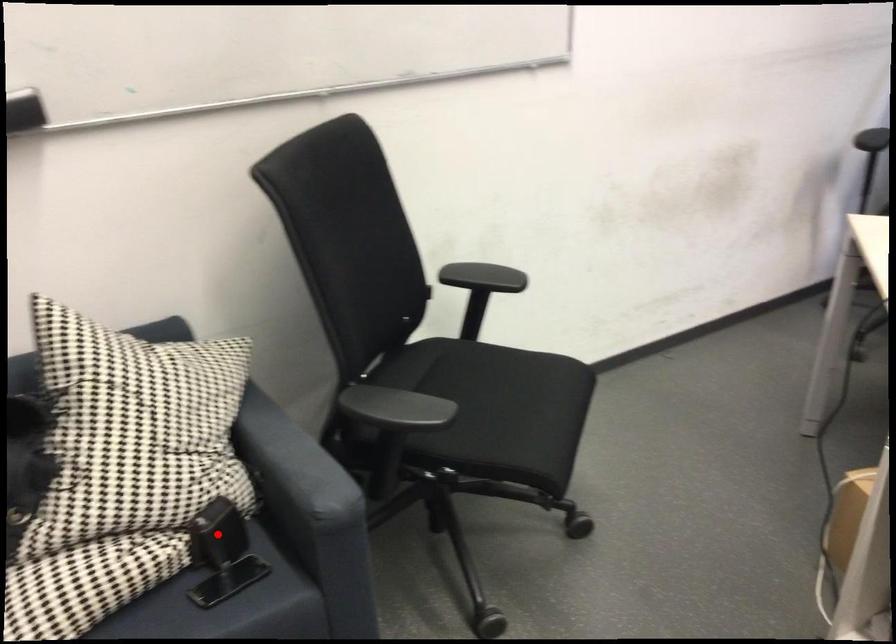
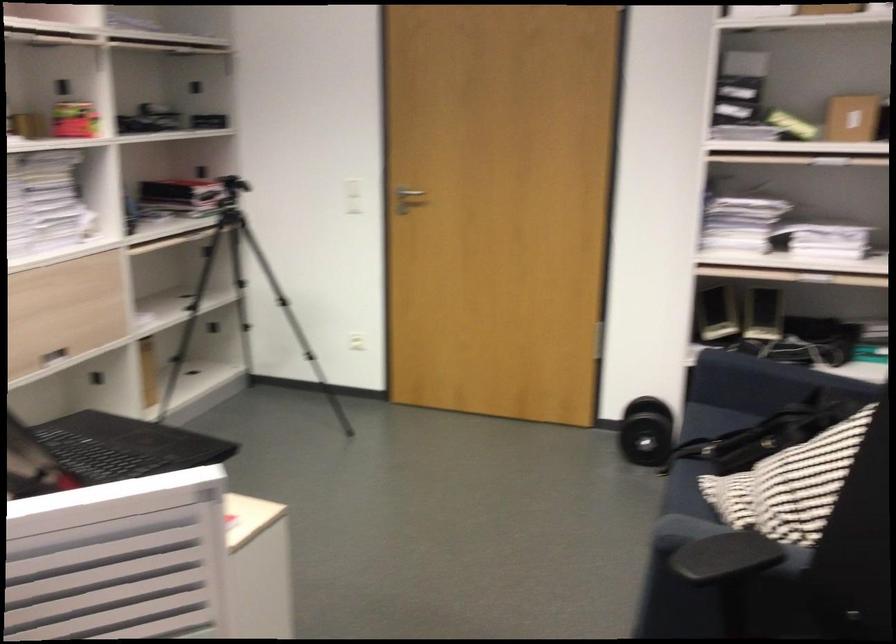
Question: I am providing you with two images of the same scene from different viewpoints. A red point is marked on the first image. At the location where the point appears in image 1, is it still visible in image 2?

Choices:
 (A) Yes
 (B) No

Answer: (B)